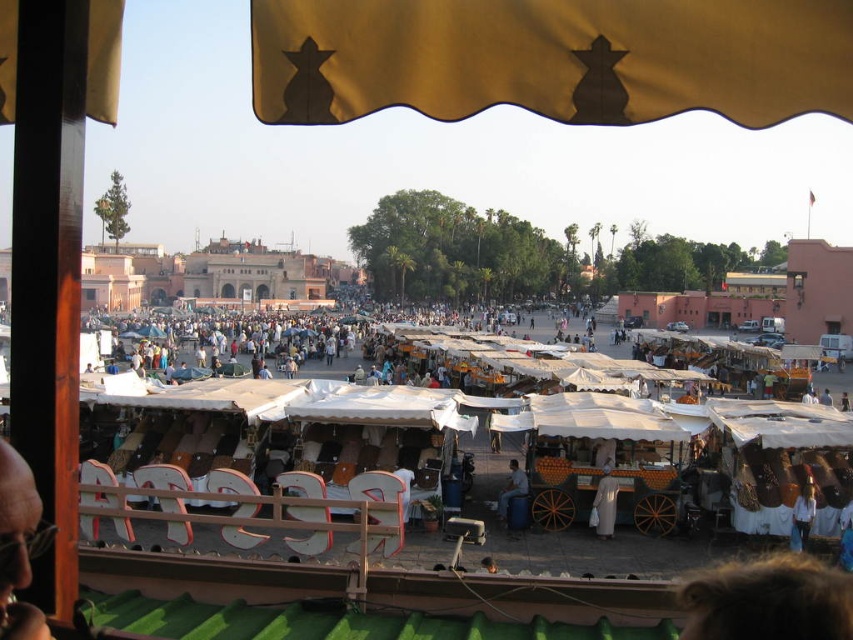
You are a vendor at the market and want to place a new stand between the white cotton dress at lower right and the light brown wooden cart at center. Based on their widths, will there be enough space for the stand if it requires 1 meter of space?

The white cotton dress at lower right might be wider than light brown wooden cart at center, so there may not be enough space for the stand requiring 1 meter of space. Check the actual width before placing the stand.

You are standing at the balcony with the green corrugated roof and wooden railing. You see two points in the market below you. One is at coordinate point (802, 547) and the other is at point (514, 484). Which point is closer to your current position?

Point (802, 547) is closer to the camera than point (514, 484), so the point at (802, 547) is closer to your current position on the balcony.